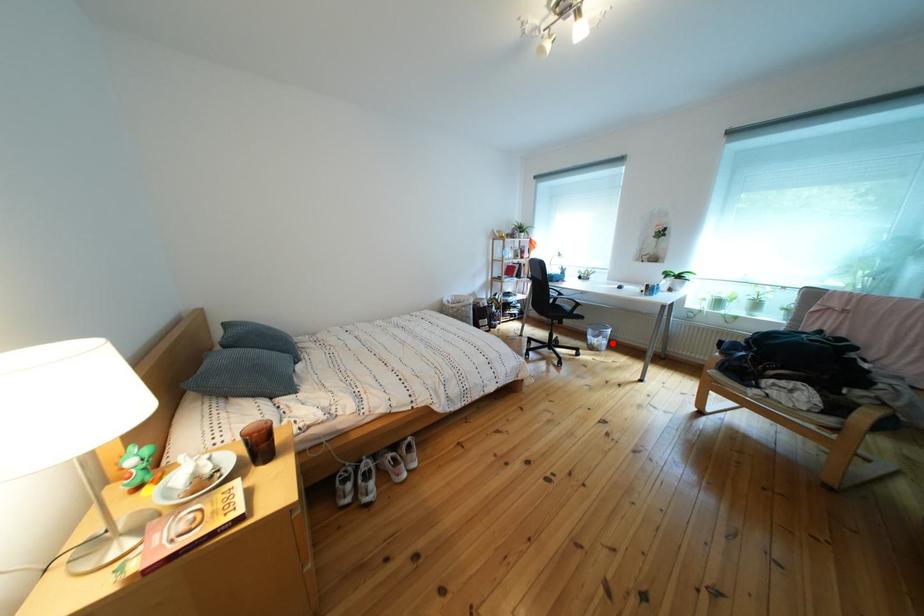
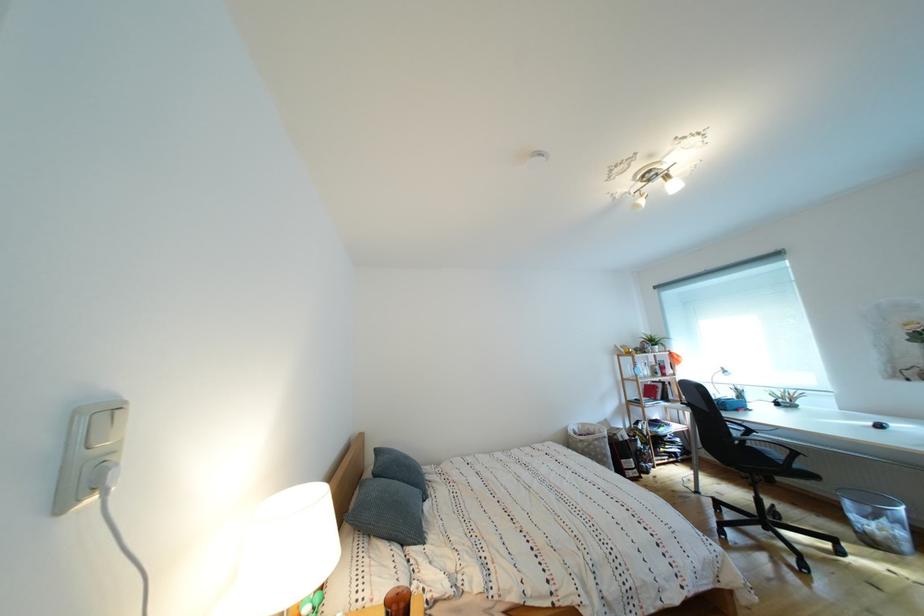
Question: I am providing you with two images of the same scene from different viewpoints. A red point is shown in image1. For the corresponding object point in image2, is it positioned nearer or farther from the camera?

Choices:
 (A) Nearer
 (B) Farther

Answer: (A)